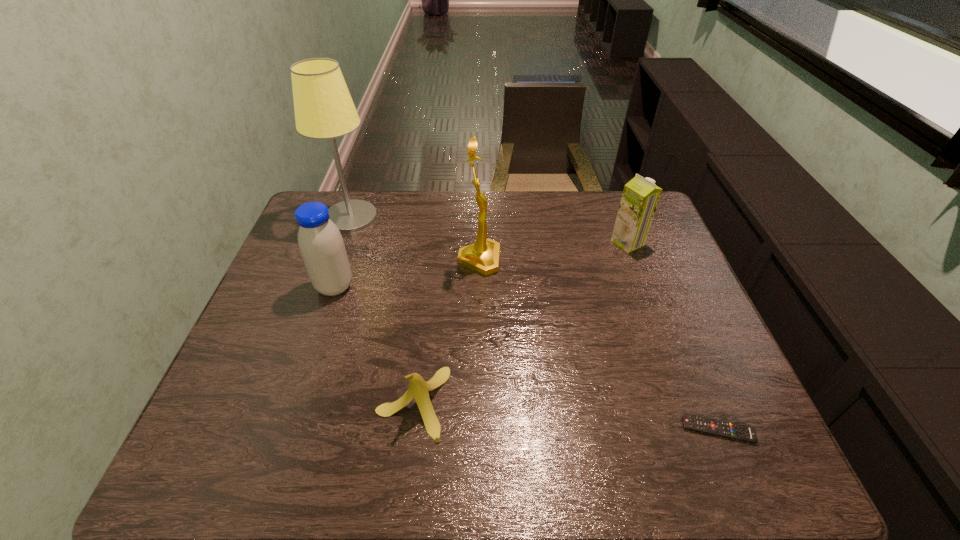
Identify the location of vacant space that satisfies the following two spatial constraints: 1. on the front-facing side of the shortest object; 2. on the left side of the fifth shortest object. (479, 429).

The image size is (960, 540). I want to click on free space that satisfies the following two spatial constraints: 1. on the front side of the shortest object; 2. on the left side of the right soya milk, so click(x=698, y=429).